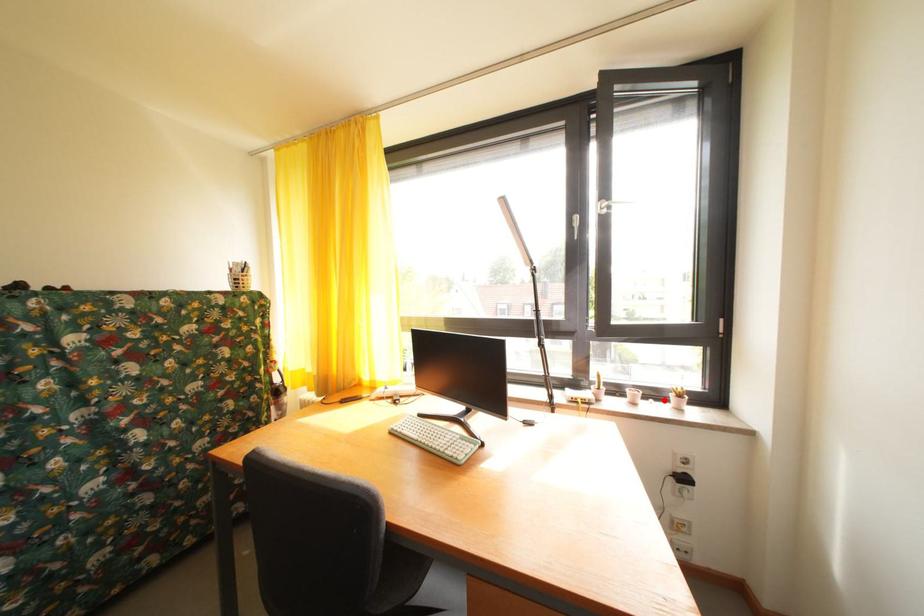
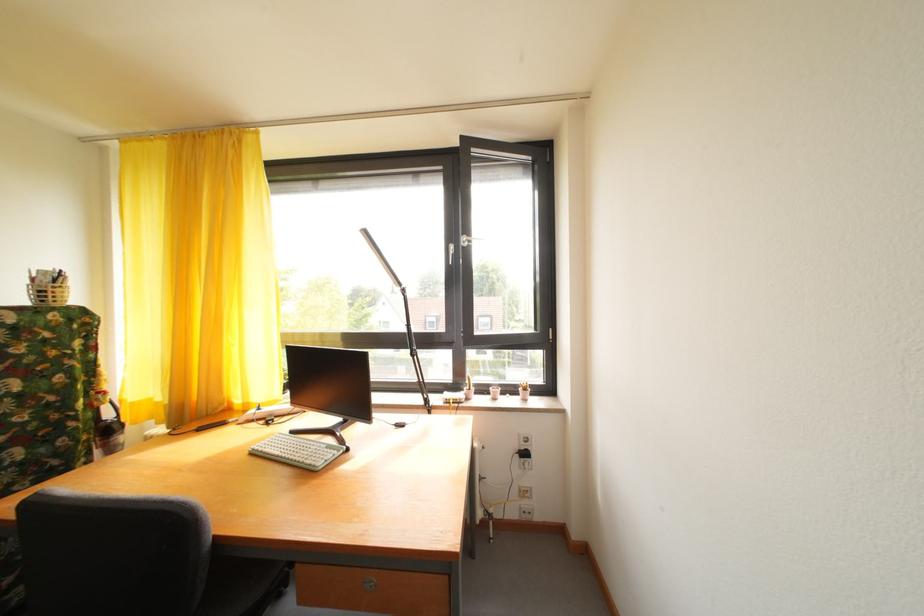
Question: I am providing you with two images of the same scene from different viewpoints. A red point is marked on the first image. Is the red point's position out of view in image 2?

Choices:
 (A) Yes
 (B) No

Answer: (B)